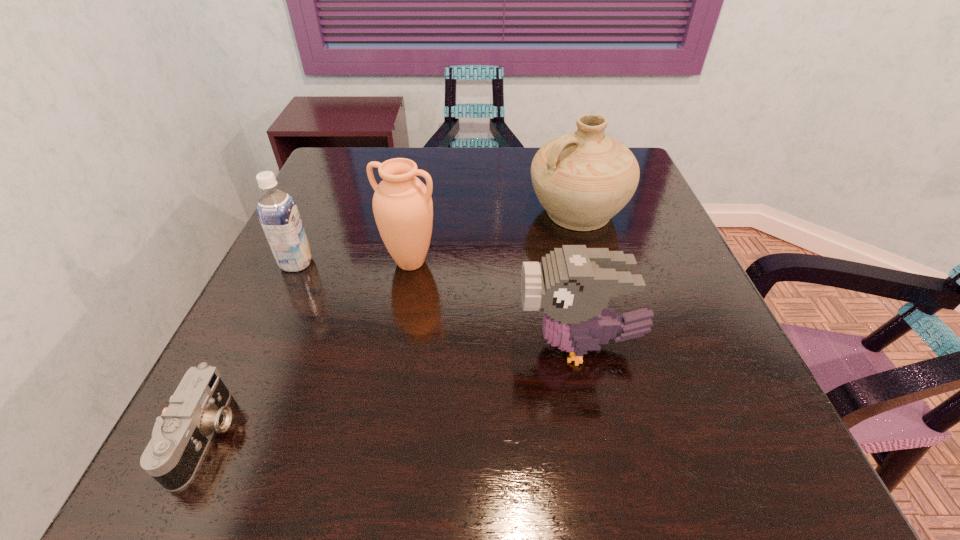
Where is `free spot at the far edge of the desktop`? This screenshot has width=960, height=540. free spot at the far edge of the desktop is located at coordinates (499, 180).

This screenshot has height=540, width=960. Find the location of `vacant area at the near edge`. vacant area at the near edge is located at coordinates (276, 488).

In order to click on blank space at the left edge in this screenshot , I will do `click(319, 229)`.

At what (x,y) coordinates should I click in order to perform the action: click on free region at the right edge. Please return your answer as a coordinate pair (x, y). Image resolution: width=960 pixels, height=540 pixels. Looking at the image, I should click on (711, 352).

Find the location of a particular element. free space between the nearest object and the third object from right to left is located at coordinates (308, 349).

In order to click on unoccupied position between the camera and the urn in this screenshot , I will do `click(308, 349)`.

Where is `free point between the nearest object and the third object from left to right`? free point between the nearest object and the third object from left to right is located at coordinates (308, 349).

Locate an element on the screen. empty space that is in between the soya milk and the camera is located at coordinates (252, 349).

This screenshot has width=960, height=540. Find the location of `free space between the camera and the bird`. free space between the camera and the bird is located at coordinates (393, 391).

Locate an element on the screen. free point between the farthest object and the shortest object is located at coordinates (392, 325).